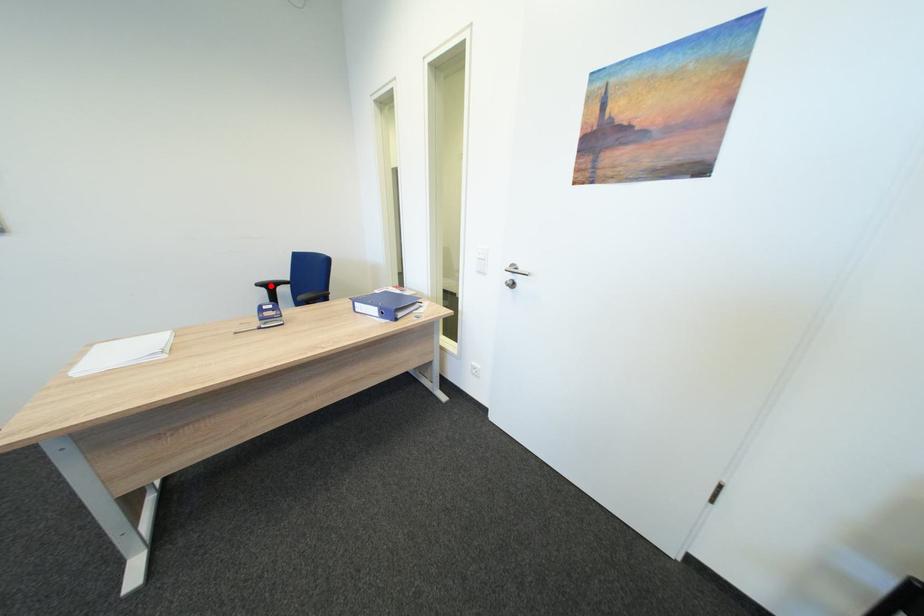
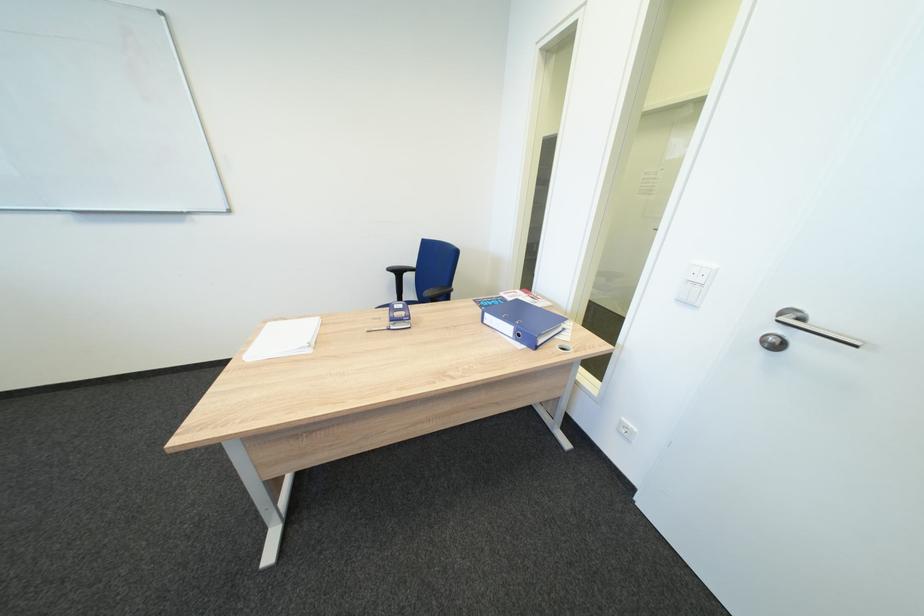
Locate, in the second image, the point that corresponds to the highlighted location in the first image.

(400, 270)